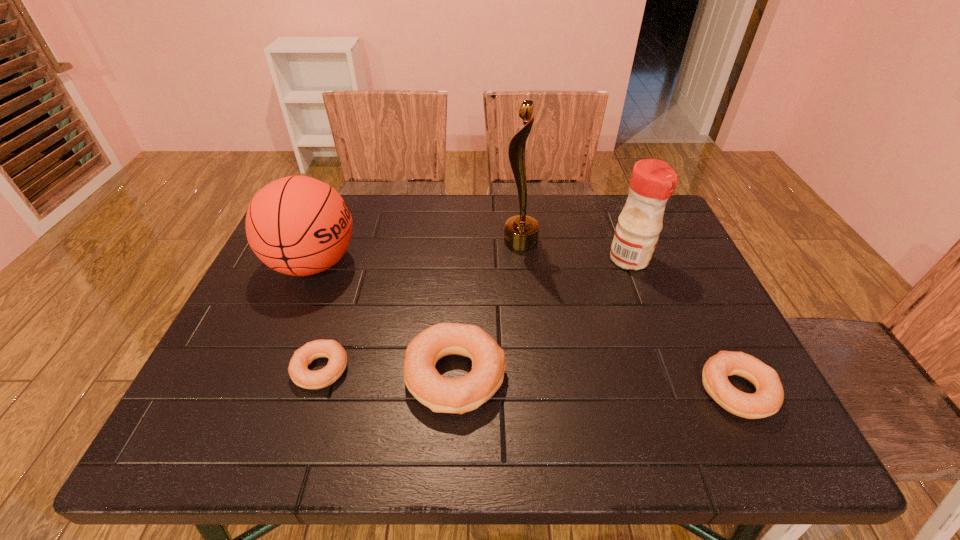
This screenshot has height=540, width=960. I want to click on vacant space that satisfies the following two spatial constraints: 1. on the front-facing side of the award; 2. on the left side of the condiment, so click(522, 259).

Image resolution: width=960 pixels, height=540 pixels. I want to click on vacant area that satisfies the following two spatial constraints: 1. on the side with logo of the fifth tallest object; 2. on the right side of the basketball, so click(260, 390).